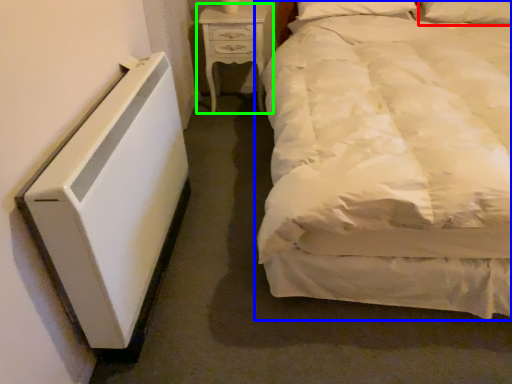
Question: Estimate the real-world distances between objects in this image. Which object is farther from pillow (highlighted by a red box), bed (highlighted by a blue box) or nightstand (highlighted by a green box)?

Choices:
 (A) bed
 (B) nightstand

Answer: (A)